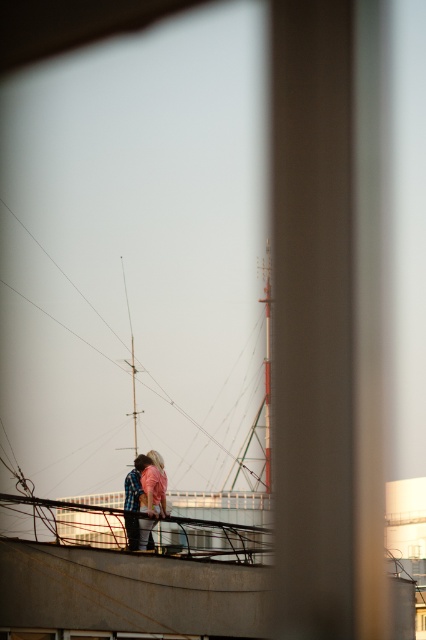
Does pink fabric at center appear over metallic mast at center?

No.

Between point (158, 477) and point (264, 284), which one is positioned in front?

Positioned in front is point (158, 477).

Is point (149, 477) more distant than point (270, 291)?

No, (149, 477) is in front of (270, 291).

I want to click on pink fabric at center, so click(150, 492).

Who is positioned more to the left, pink fabric at center or wooden mast at center?

From the viewer's perspective, wooden mast at center appears more on the left side.

This screenshot has width=426, height=640. In order to click on pink fabric at center in this screenshot , I will do `click(150, 492)`.

Is point (164, 499) positioned before point (123, 288)?

Yes.

I want to click on pink fabric at center, so (150, 492).

Is point (264, 356) closer to viewer compared to point (132, 337)?

That is True.

Looking at this image, is metallic mast at center further to the viewer compared to wooden mast at center?

No, metallic mast at center is in front of wooden mast at center.

The height and width of the screenshot is (640, 426). Identify the location of metallic mast at center. (267, 364).